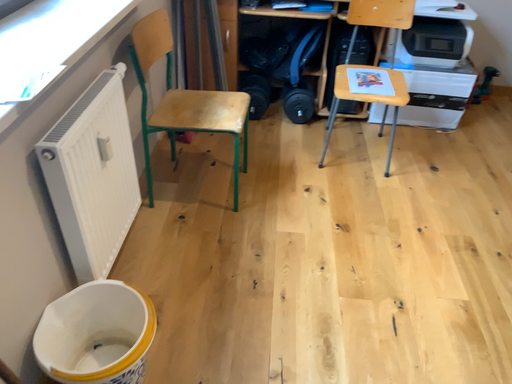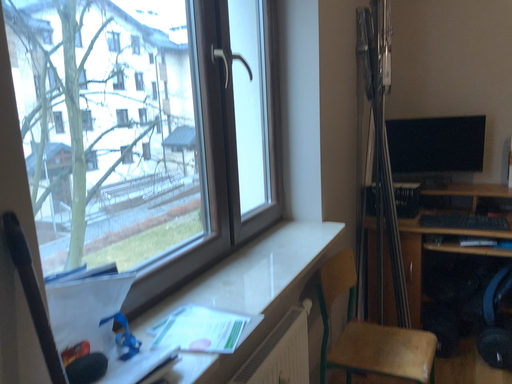
Question: How did the camera likely rotate when shooting the video?

Choices:
 (A) rotated left
 (B) rotated right

Answer: (A)